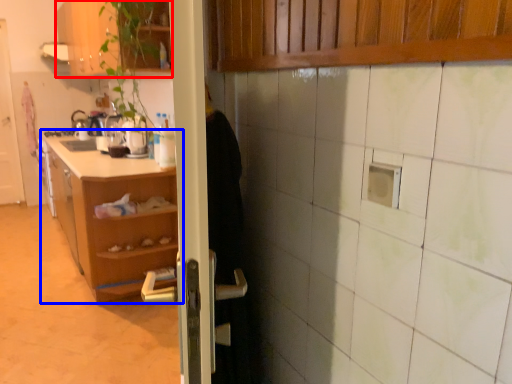
Question: Which object is further to the camera taking this photo, cabinetry (highlighted by a red box) or shelf (highlighted by a blue box)?

Choices:
 (A) cabinetry
 (B) shelf

Answer: (B)